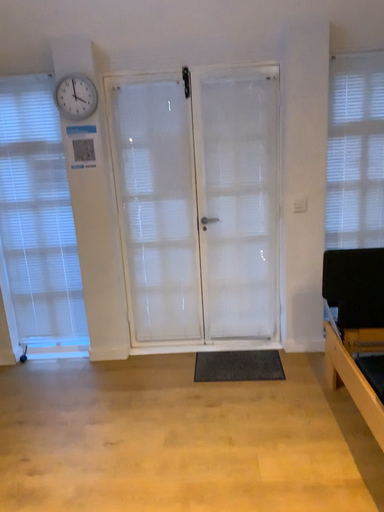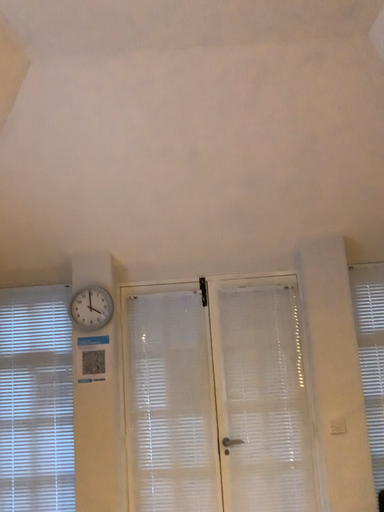
Question: Which way did the camera rotate in the video?

Choices:
 (A) rotated upward
 (B) rotated downward

Answer: (A)